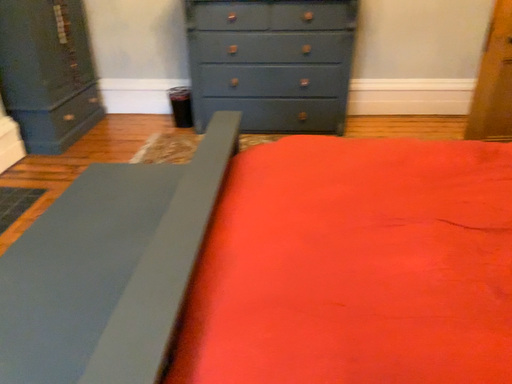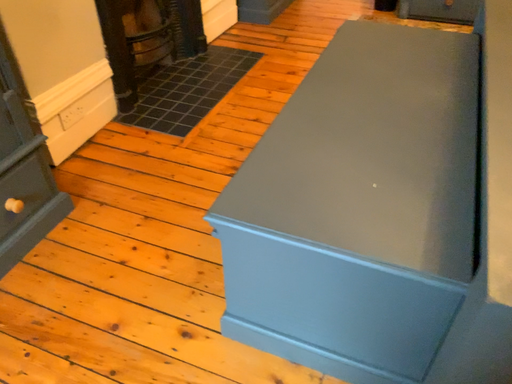
Question: Which way did the camera rotate in the video?

Choices:
 (A) rotated downward
 (B) rotated upward

Answer: (A)